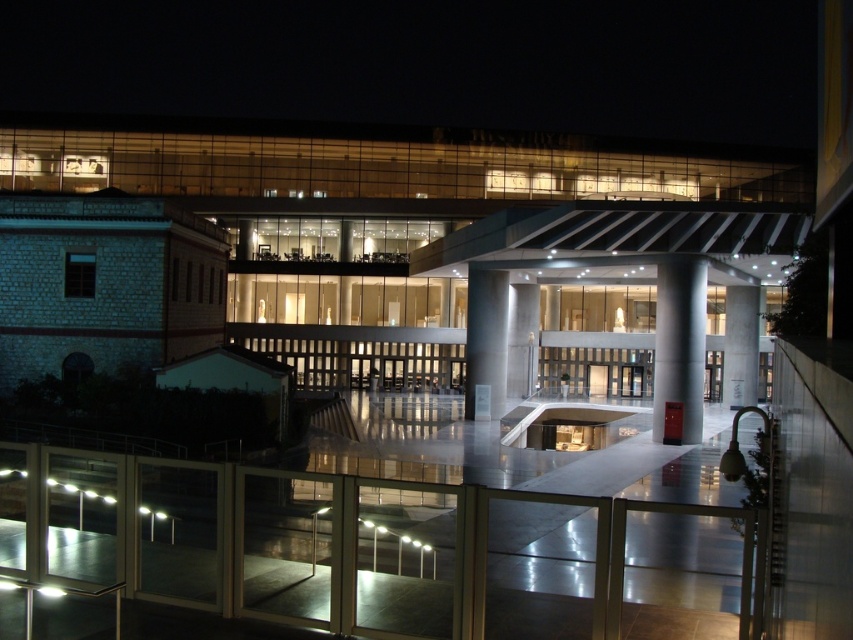
Does sleek metallic column at center lie behind white glossy pillar at center?

No, sleek metallic column at center is in front of white glossy pillar at center.

Is sleek metallic column at center bigger than white glossy pillar at center?

Yes, sleek metallic column at center is bigger than white glossy pillar at center.

Is point (483, 387) positioned behind point (730, 292)?

No, it is not.

Identify the location of sleek metallic column at center. (485, 342).

Is white smooth pillar at center in front of sleek metallic column at center?

Yes.

In the scene shown: Does white smooth pillar at center appear on the left side of sleek metallic column at center?

No, white smooth pillar at center is not to the left of sleek metallic column at center.

Image resolution: width=853 pixels, height=640 pixels. Find the location of `white smooth pillar at center`. white smooth pillar at center is located at coordinates (679, 344).

From the picture: Does white smooth pillar at center appear over white glossy pillar at center?

No, white smooth pillar at center is not above white glossy pillar at center.

Does white smooth pillar at center have a larger size compared to white glossy pillar at center?

No.

Describe the element at coordinates (679, 344) in the screenshot. I see `white smooth pillar at center` at that location.

Where is `white smooth pillar at center`? white smooth pillar at center is located at coordinates (679, 344).